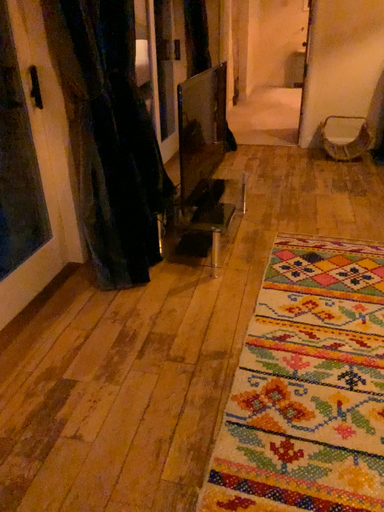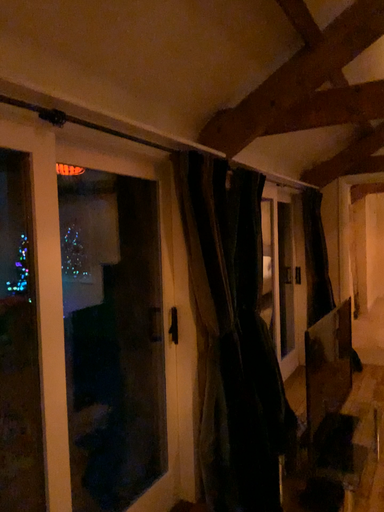
Question: How did the camera likely rotate when shooting the video?

Choices:
 (A) rotated upward
 (B) rotated downward

Answer: (A)